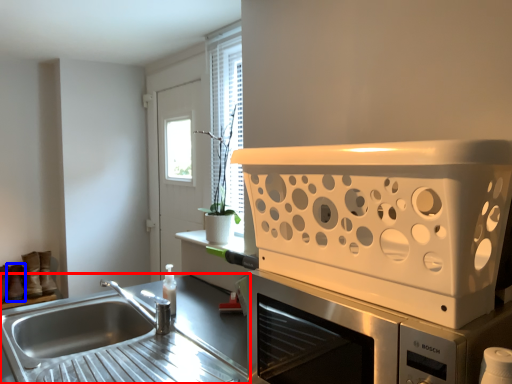
Question: Which object appears closest to the camera in this image, countertop (highlighted by a red box) or shoe (highlighted by a blue box)?

Choices:
 (A) countertop
 (B) shoe

Answer: (A)